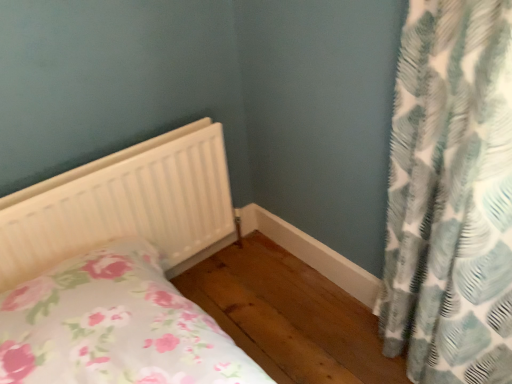
Question: Looking at the image, does white matte radiator at lower left seem bigger or smaller compared to teal and white patterned curtain at right?

Choices:
 (A) big
 (B) small

Answer: (B)

Question: Considering the positions of white matte radiator at lower left and teal and white patterned curtain at right in the image, is white matte radiator at lower left taller or shorter than teal and white patterned curtain at right?

Choices:
 (A) short
 (B) tall

Answer: (A)

Question: In the image, is white matte radiator at lower left positioned in front of or behind teal and white patterned curtain at right?

Choices:
 (A) behind
 (B) front

Answer: (A)

Question: In terms of width, does teal and white patterned curtain at right look wider or thinner when compared to white matte radiator at lower left?

Choices:
 (A) thin
 (B) wide

Answer: (B)

Question: Is teal and white patterned curtain at right taller or shorter than white matte radiator at lower left?

Choices:
 (A) tall
 (B) short

Answer: (A)

Question: Does point (470, 82) appear closer or farther from the camera than point (31, 203)?

Choices:
 (A) closer
 (B) farther

Answer: (A)

Question: From a real-world perspective, is teal and white patterned curtain at right positioned above or below white matte radiator at lower left?

Choices:
 (A) above
 (B) below

Answer: (A)